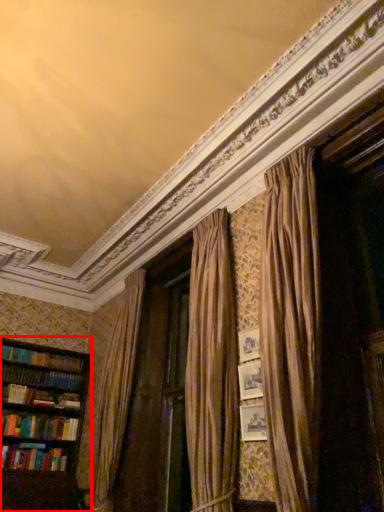
Question: From the image, what is the correct spatial relationship of bookcase (annotated by the red box) in relation to book?

Choices:
 (A) right
 (B) left

Answer: (A)